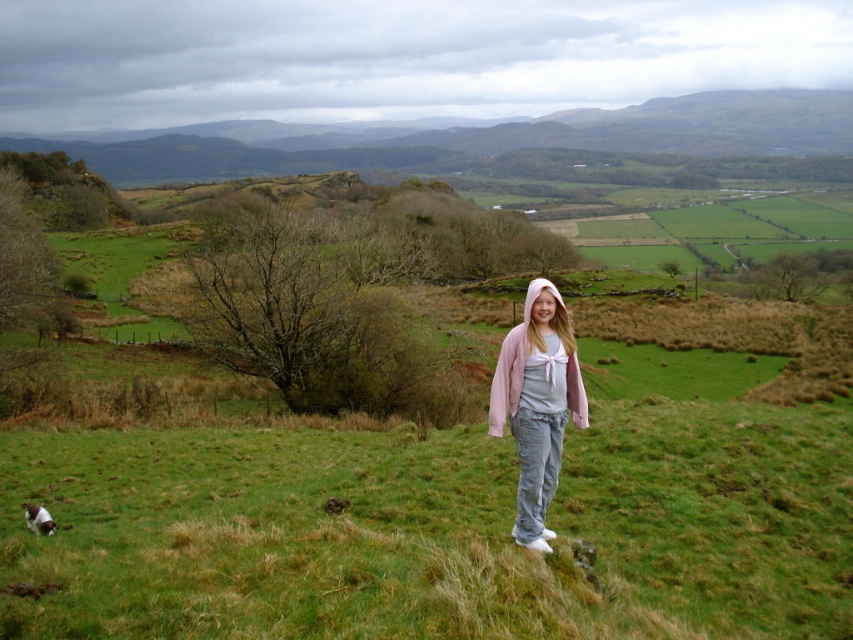
Question: Does green grassy hillside at upper center appear under pink cotton hoodie at center?

Choices:
 (A) no
 (B) yes

Answer: (A)

Question: Does green grassy hillside at upper center come behind pink cotton hoodie at center?

Choices:
 (A) yes
 (B) no

Answer: (A)

Question: Which object is closer to the camera taking this photo?

Choices:
 (A) pink cotton hoodie at center
 (B) green grassy hillside at upper center

Answer: (A)

Question: Does green grassy hillside at upper center appear under pink cotton hoodie at center?

Choices:
 (A) no
 (B) yes

Answer: (A)